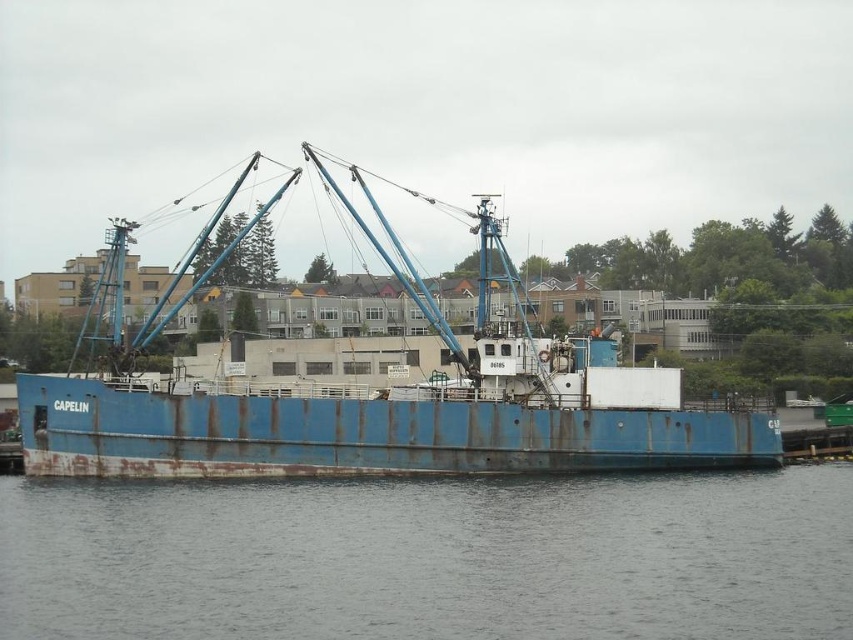
You are standing on the deck of the CAPELIN fishing vessel and want to locate the gray water at lower center. According to the coordinates provided, where exactly should you look to find it?

The gray water at lower center is located at point 0.873 on the x axis and 0.509 on the y axis, so you should look towards the lower center area of the image based on these coordinates.

You are standing on the dock and see the gray water at lower center and the rusty metal boat at center. Which object is closer to the dock?

The gray water at lower center is positioned under the rusty metal boat at center, so the gray water at lower center is closer to the dock.

You are a photographer planning to capture the rusty metal boat at center and the gray water at lower center in a single frame. Based on their widths, which one would appear wider in the photo?

The rusty metal boat at center appears wider in the photo because the gray water at lower center has a lesser width compared to it.